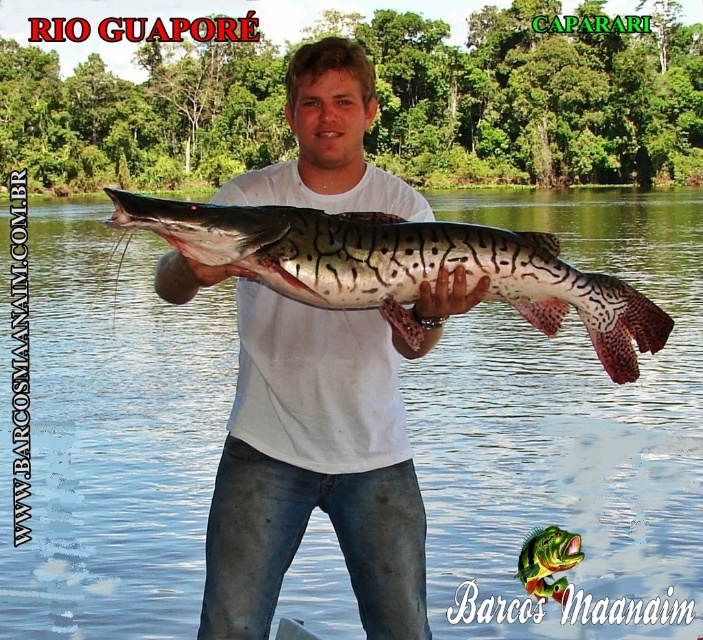
Consider the image. Can you confirm if clear water at center is taller than speckled skin catfish at center?

Indeed, clear water at center has a greater height compared to speckled skin catfish at center.

Which is below, clear water at center or speckled skin catfish at center?

Positioned lower is speckled skin catfish at center.

Between point (161, 474) and point (399, 321), which one is positioned in front?

Point (399, 321) is more forward.

You are a GUI agent. You are given a task and a screenshot of the screen. Output one action in this format:
    pyautogui.click(x=<x>, y=<y>)
    Task: Click on the clear water at center
    The width and height of the screenshot is (703, 640).
    Given the screenshot: What is the action you would take?
    pyautogui.click(x=565, y=426)

Which of these two, clear water at center or white matte shirt at center, stands shorter?

white matte shirt at center

Is clear water at center below white matte shirt at center?

No, clear water at center is not below white matte shirt at center.

Locate an element on the screen. The height and width of the screenshot is (640, 703). clear water at center is located at coordinates (565, 426).

Does white matte shirt at center appear on the right side of speckled skin catfish at center?

In fact, white matte shirt at center is to the left of speckled skin catfish at center.

Does white matte shirt at center have a larger size compared to speckled skin catfish at center?

Yes, white matte shirt at center is bigger than speckled skin catfish at center.

Does point (361, 579) come in front of point (389, 275)?

No, (361, 579) is behind (389, 275).

The height and width of the screenshot is (640, 703). Find the location of `white matte shirt at center`. white matte shirt at center is located at coordinates (321, 460).